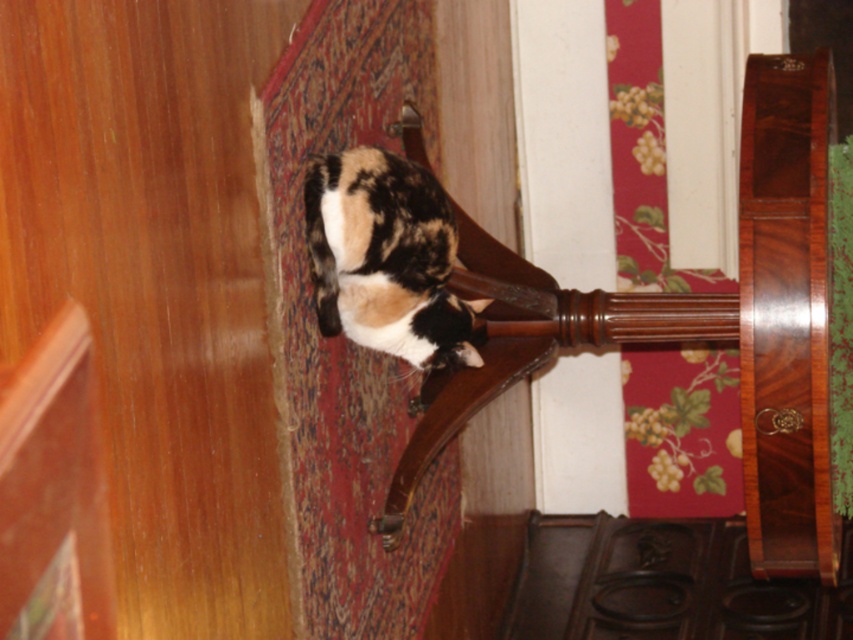
You are a delivery person carrying a box that is 22 inches wide. You need to pass between the shiny wood chair at center and the calico fur cat at center. Can you fit through the space between them?

The shiny wood chair at center is 21.92 inches from calico fur cat at center. Since the box is 22 inches wide, it is slightly wider than the available space. Therefore, the box cannot fit through the space between them.

You are a guest entering the room and want to sit down. There is a shiny wood chair at center and a calico fur cat at center. Which object should you approach to sit, considering their positions?

You should approach the shiny wood chair at center because it is positioned to the right of the calico fur cat at center, making it accessible for sitting.